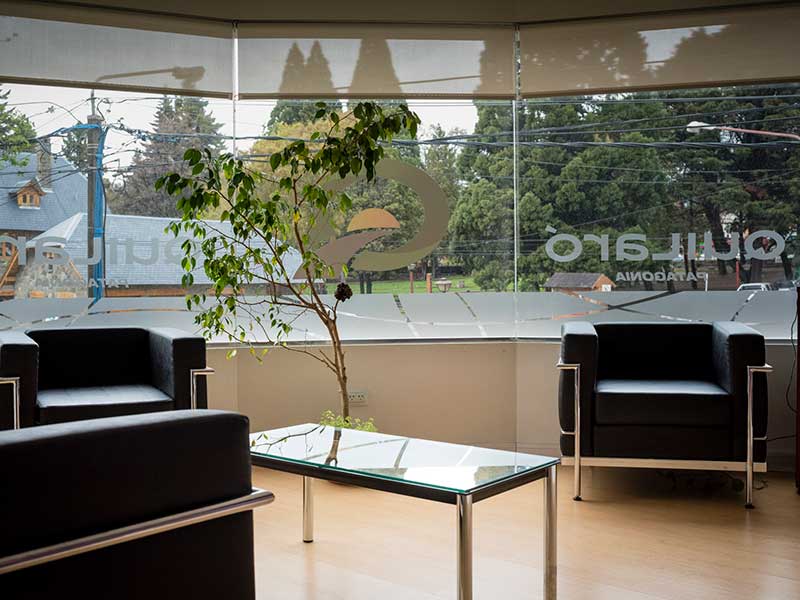
Where is `table legs`? table legs is located at coordinates (466, 538), (546, 522), (301, 505).